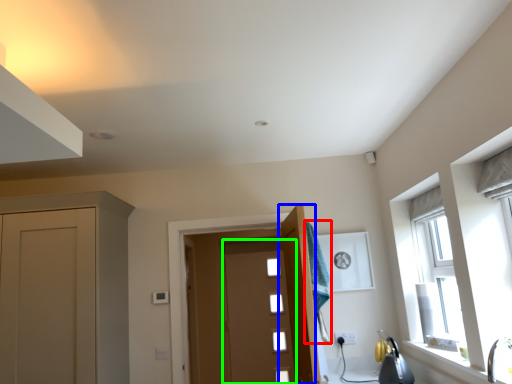
Question: Based on their relative distances, which object is nearer to laundry (highlighted by a red box)? Choose from door (highlighted by a blue box) and door (highlighted by a green box).

Choices:
 (A) door
 (B) door

Answer: (A)